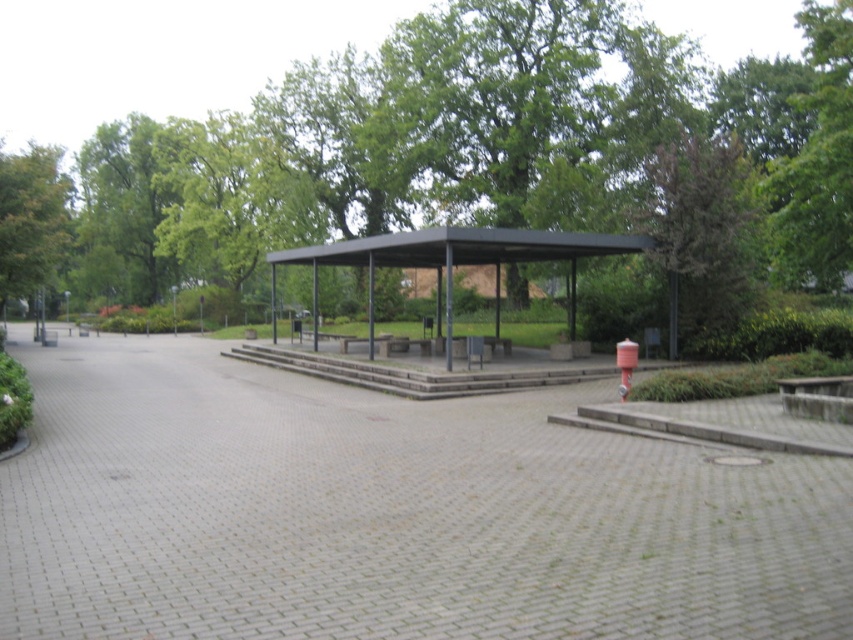
You are a maintenance worker tasked with watering the green leafy tree at left. You have a hose that can reach up to 14 meters. You are currently standing at the gray brick path at center. Can you water the tree without moving your position?

The gray brick path at center is 15.01 meters from the green leafy tree at left. Since the hose can only reach up to 14 meters, you cannot water the tree without moving your position.

You are standing at the entrance of the park and see the green leafy tree at center. If you walk straight ahead, will you reach the tree before the pavilion?

The green leafy tree at center is located at point (494, 157), which is closer to the entrance than the pavilion, so yes, you will reach the tree before the pavilion.

You are planning to set up a small outdoor event in the park and need to place a 3m wide tent. The tent requires a clear, flat area free of obstacles. Looking at the image, which object between the green leafy tree at center and the metallic structure at center would you avoid placing the tent near to ensure enough space?

The green leafy tree at center has a larger size compared to the metallic structure at center, so you should avoid placing the tent near the green leafy tree at center to ensure enough space.